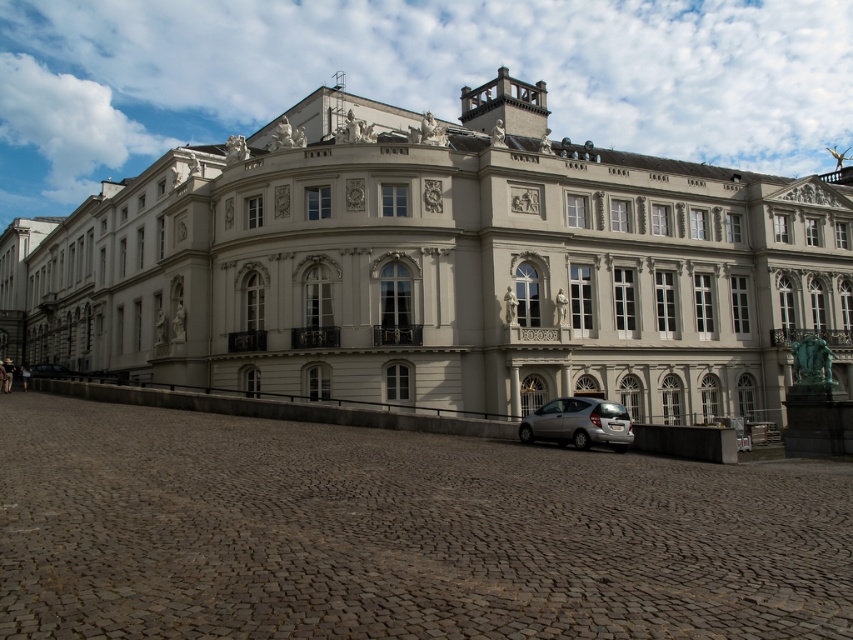
Question: From the image, what is the correct spatial relationship of white stone building at center in relation to silver metallic hatchback at lower center?

Choices:
 (A) left
 (B) right

Answer: (A)

Question: Can you confirm if white stone building at center is positioned to the right of silver metallic hatchback at lower center?

Choices:
 (A) no
 (B) yes

Answer: (A)

Question: Is white stone building at center above silver metallic hatchback at lower center?

Choices:
 (A) no
 (B) yes

Answer: (B)

Question: Which object appears farthest from the camera in this image?

Choices:
 (A) silver metallic hatchback at lower center
 (B) white stone building at center

Answer: (B)

Question: Which point is farther to the camera?

Choices:
 (A) silver metallic hatchback at lower center
 (B) white stone building at center

Answer: (B)